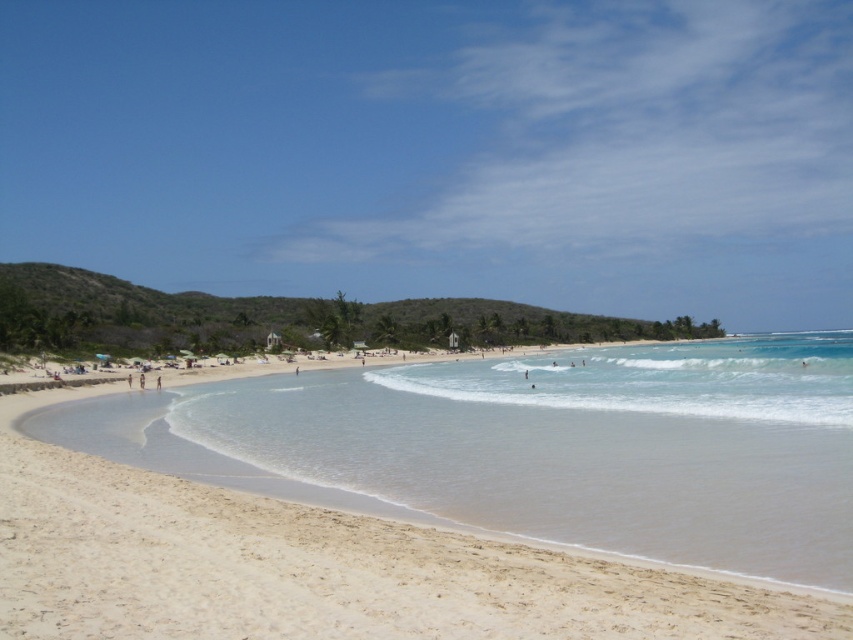
You are standing on the beach and want to reach the point marked as point (x=122, y=625). If you walk straight ahead from your current position, will you reach that point before walking 25 feet?

Yes, because the point (x=122, y=625) is only 22.59 feet away from the viewer, which is less than 25 feet.

You are standing at the point with coordinates point (555,406) and want to walk to the water. Is the point point (12,496) between you and the water?

Yes, the point point (12,496) is between you and the water because it is in front of point point (555,406), which is your current position.

You are standing on the white sand beach at center and want to reach the clear blue water at center. Which direction should you move to get there?

Since the white sand beach at center is closer to the viewer than the clear blue water at center, you should move forward to reach the clear blue water at center.